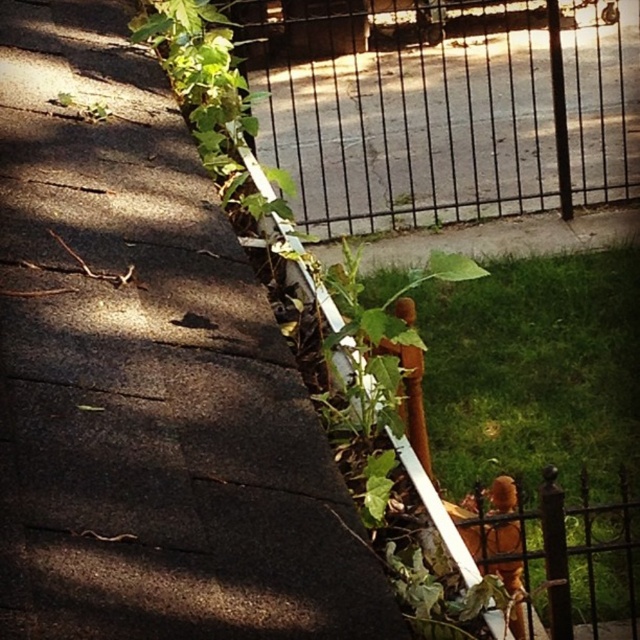
Is point (460, 141) farther from camera compared to point (564, 605)?

That is True.

Measure the distance between black metal fence at upper center and green leafy plant at center.

5.94 feet

Which is in front, point (600, 33) or point (504, 314)?

Positioned in front is point (504, 314).

This screenshot has height=640, width=640. Find the location of `black metal fence at upper center`. black metal fence at upper center is located at coordinates (442, 108).

Who is lower down, green leafy plant at upper center or green leafy plant at center?

green leafy plant at center

Is point (170, 451) farther from camera compared to point (628, 602)?

That is False.

This screenshot has height=640, width=640. I want to click on green leafy plant at upper center, so click(x=147, y=378).

Is green leafy plant at upper center shorter than black metal fence at upper center?

Indeed, green leafy plant at upper center has a lesser height compared to black metal fence at upper center.

Does green leafy plant at upper center appear on the left side of black metal fence at upper center?

Indeed, green leafy plant at upper center is positioned on the left side of black metal fence at upper center.

Which is in front, point (202, 392) or point (376, 211)?

Point (202, 392) is more forward.

Where is `green leafy plant at upper center`? This screenshot has width=640, height=640. green leafy plant at upper center is located at coordinates (147, 378).